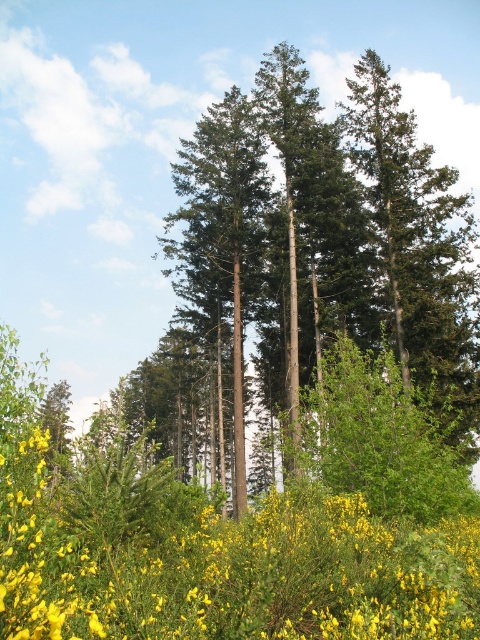
Question: Which object is farther from the camera taking this photo?

Choices:
 (A) yellow matte flower at center
 (B) green rough bark trees at center

Answer: (B)

Question: Does yellow matte flower at center appear on the right side of green rough bark trees at center?

Choices:
 (A) no
 (B) yes

Answer: (B)

Question: Can you confirm if yellow matte flower at center is positioned to the right of green rough bark trees at center?

Choices:
 (A) yes
 (B) no

Answer: (A)

Question: Among these objects, which one is nearest to the camera?

Choices:
 (A) green rough bark trees at center
 (B) yellow matte flower at center

Answer: (B)

Question: Can you confirm if yellow matte flower at center is positioned above green rough bark trees at center?

Choices:
 (A) yes
 (B) no

Answer: (B)

Question: Which of the following is the farthest from the observer?

Choices:
 (A) (108, 580)
 (B) (253, 164)

Answer: (B)